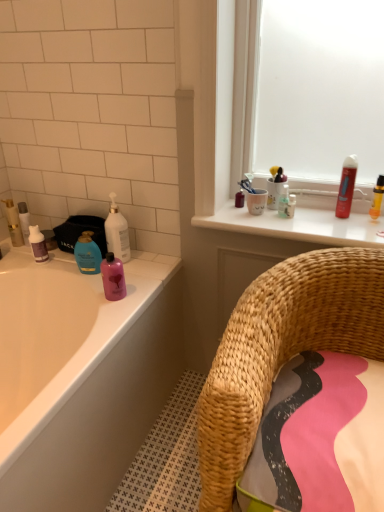
At what (x,y) coordinates should I click in order to perform the action: click on vacant area that lies between blue glossy lotion at left, which is counted as the 4th toiletry, starting from the right, and purple matte bottle at left, the second mouthwash in the top-to-bottom sequence. Please return your answer as a coordinate pair (x, y). The image size is (384, 512). Looking at the image, I should click on (61, 264).